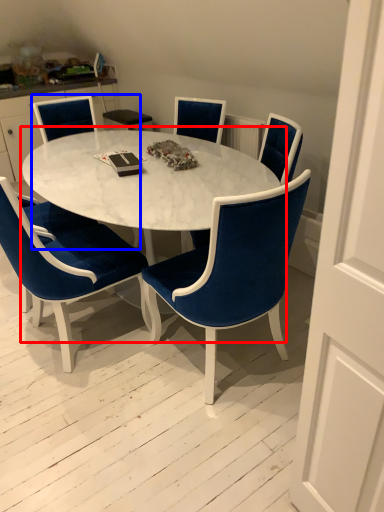
Question: Which point is closer to the camera, coffee table (highlighted by a red box) or chair (highlighted by a blue box)?

Choices:
 (A) coffee table
 (B) chair

Answer: (A)